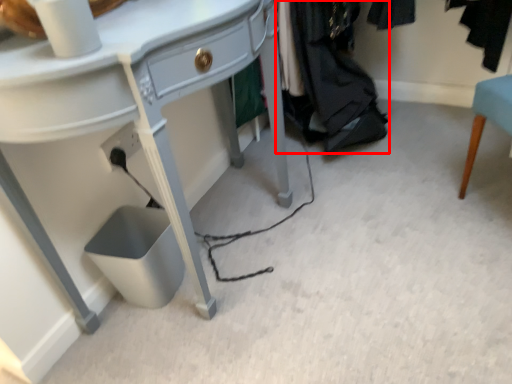
Question: From the image's perspective, considering the relative positions of clothing (annotated by the red box) and desk in the image provided, where is clothing (annotated by the red box) located with respect to the staircase?

Choices:
 (A) below
 (B) above

Answer: (B)